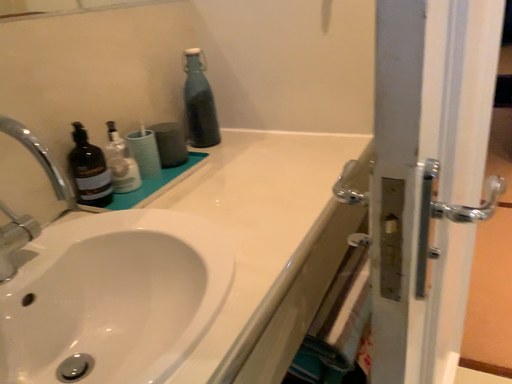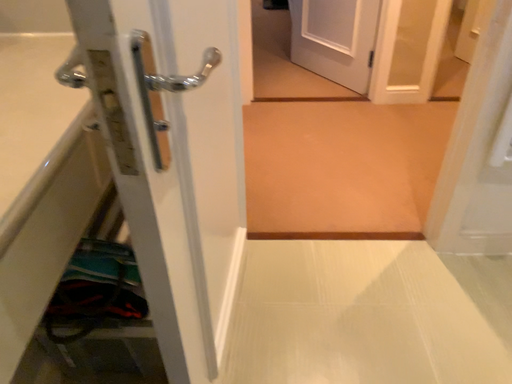
Question: How did the camera likely rotate when shooting the video?

Choices:
 (A) rotated left
 (B) rotated right

Answer: (B)